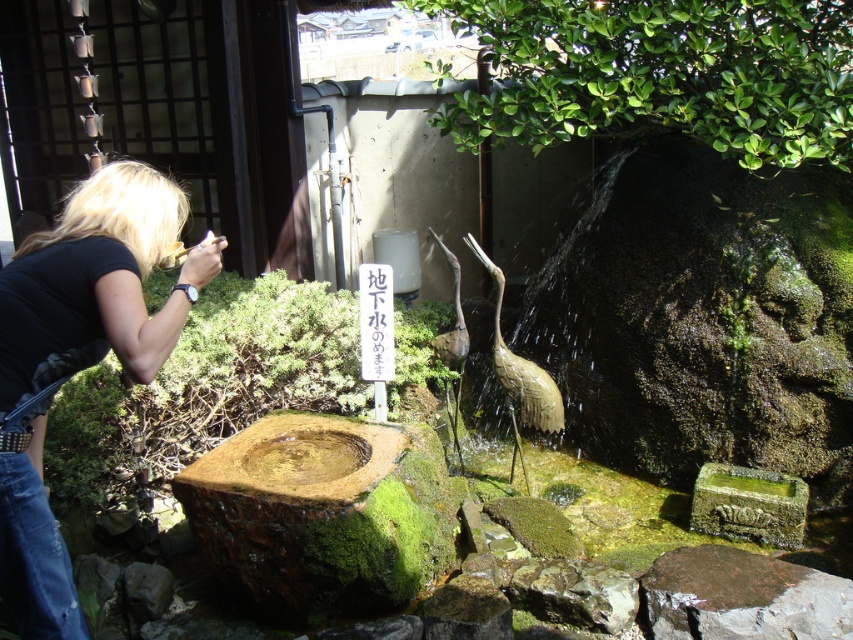
Is black fabric at left to the right of green mossy rock at lower right from the viewer's perspective?

In fact, black fabric at left is to the left of green mossy rock at lower right.

Between black fabric at left and green mossy rock at lower right, which one has less height?

Standing shorter between the two is green mossy rock at lower right.

Is point (1, 596) positioned behind point (773, 634)?

No.

The width and height of the screenshot is (853, 640). What are the coordinates of `black fabric at left` in the screenshot? It's located at (78, 355).